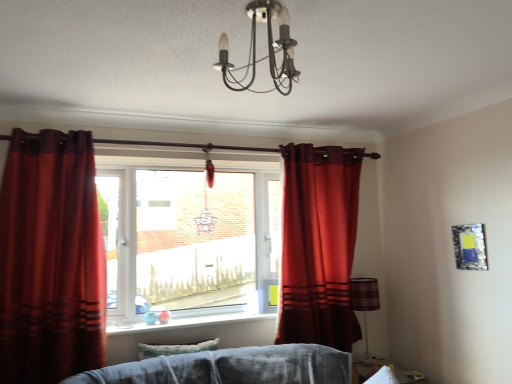
Question: Considering the positions of velvet red curtain at left, the 2th curtain viewed from the back, and clear glass window at center in the image, is velvet red curtain at left, the 2th curtain viewed from the back, wider or thinner than clear glass window at center?

Choices:
 (A) wide
 (B) thin

Answer: (B)

Question: From a real-world perspective, relative to clear glass window at center, is velvet red curtain at left, arranged as the second curtain when viewed from the right, vertically above or below?

Choices:
 (A) above
 (B) below

Answer: (B)

Question: Based on their relative distances, which object is farther from the smooth glass window sill at center?

Choices:
 (A) metallic reflective picture frame at upper right
 (B) velvet red curtain at left, the first curtain viewed from the left
 (C) clear glass window at center
 (D) matte red curtain at center, arranged as the 1th curtain when viewed from the right
 (E) plaid fabric lampshade at lower right

Answer: (A)

Question: Considering the real-world distances, which object is farthest from the clear glass window at center?

Choices:
 (A) smooth glass window sill at center
 (B) metallic reflective picture frame at upper right
 (C) velvet red curtain at left, the 1th curtain when ordered from front to back
 (D) metallic chandelier at upper center
 (E) matte red curtain at center, positioned as the 2th curtain in left-to-right order

Answer: (B)